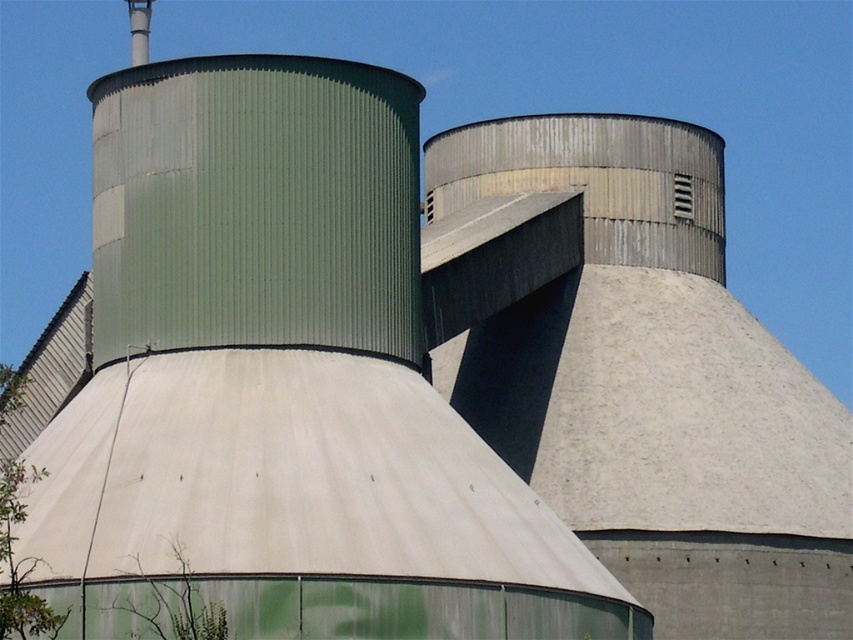
Question: Which object appears farthest from the camera in this image?

Choices:
 (A) green matte plant at lower left
 (B) green corrugated metal plant at lower left

Answer: (A)

Question: Is green corrugated metal plant at lower left closer to the viewer compared to green matte plant at lower left?

Choices:
 (A) yes
 (B) no

Answer: (A)

Question: Does green corrugated metal plant at lower left have a larger size compared to green matte plant at lower left?

Choices:
 (A) yes
 (B) no

Answer: (A)

Question: Is green corrugated metal plant at lower left smaller than green matte plant at lower left?

Choices:
 (A) yes
 (B) no

Answer: (B)

Question: Among these objects, which one is farthest from the camera?

Choices:
 (A) green corrugated metal plant at lower left
 (B) green matte plant at lower left

Answer: (B)